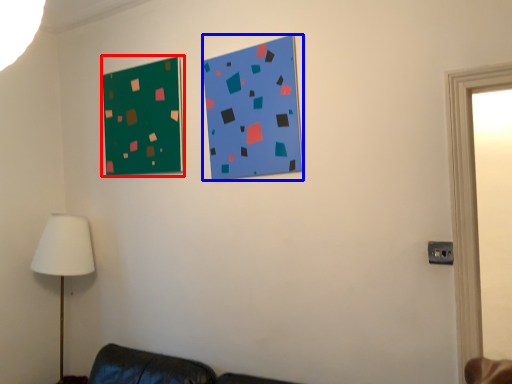
Question: Which point is closer to the camera, bulletin board (highlighted by a red box) or bulletin board (highlighted by a blue box)?

Choices:
 (A) bulletin board
 (B) bulletin board

Answer: (B)